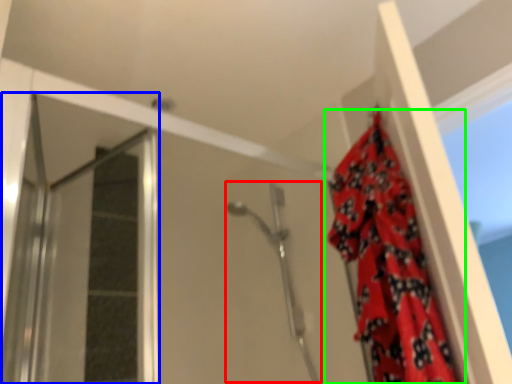
Question: Which object is positioned farthest from shower (highlighted by a red box)? Select from screen door (highlighted by a blue box) and curtain (highlighted by a green box).

Choices:
 (A) screen door
 (B) curtain

Answer: (A)